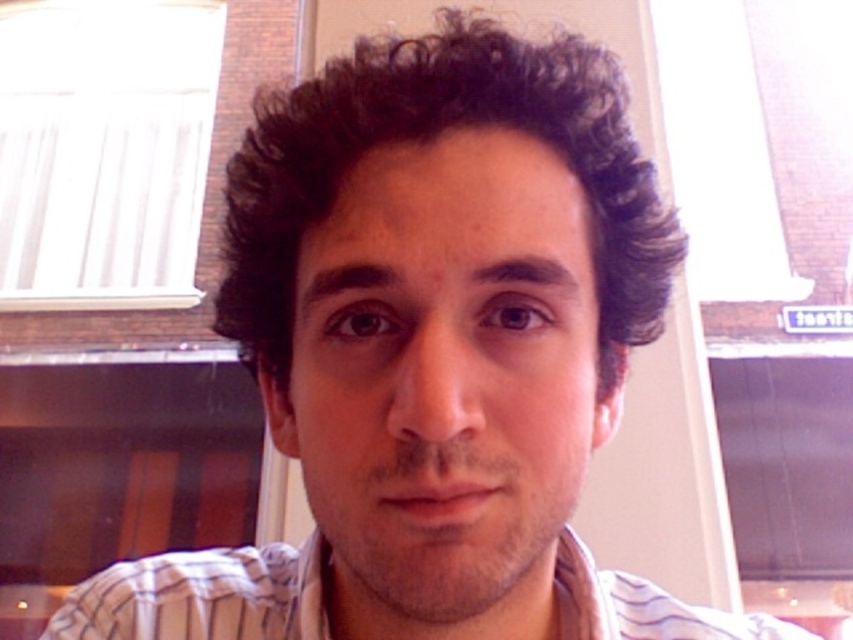
You are an artist trying to sketch this person. Based on the image, which object has a smaller width when comparing the dark curly hair at center and the white striped shirt at center?

The dark curly hair at center has a lesser width compared to the white striped shirt at center.

You are a photographer adjusting the focus on your camera. You need to ensure both the dark curly hair at center and the white striped shirt at center are in focus. Given the distance between them, will you need to adjust the aperture to a smaller fstop number to achieve this?

The dark curly hair at center is 15.98 centimeters away from the white striped shirt at center. To keep both in focus, you should use a smaller aperture, which corresponds to a higher fstop number, not a smaller one. A higher fstop number increases depth of field, allowing both objects at different distances to be in focus.